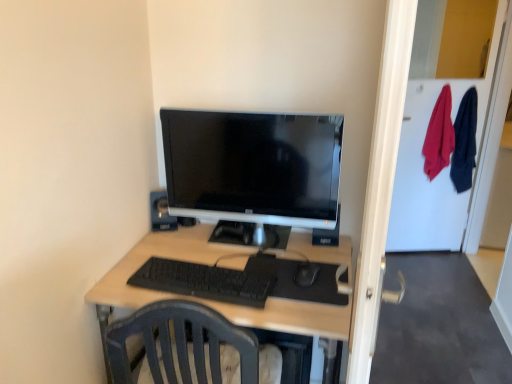
Where is `vacant space in front of black plastic mouse at center`? The image size is (512, 384). vacant space in front of black plastic mouse at center is located at coordinates (301, 314).